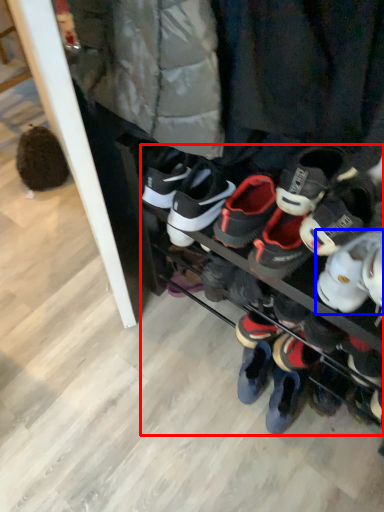
Question: Which point is further to the camera, footwear (highlighted by a red box) or footwear (highlighted by a blue box)?

Choices:
 (A) footwear
 (B) footwear

Answer: (B)